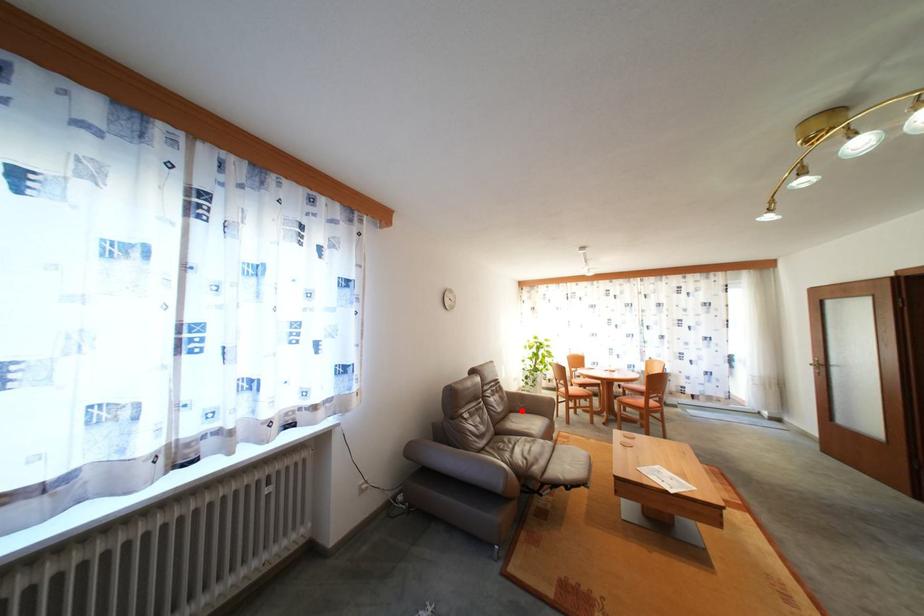
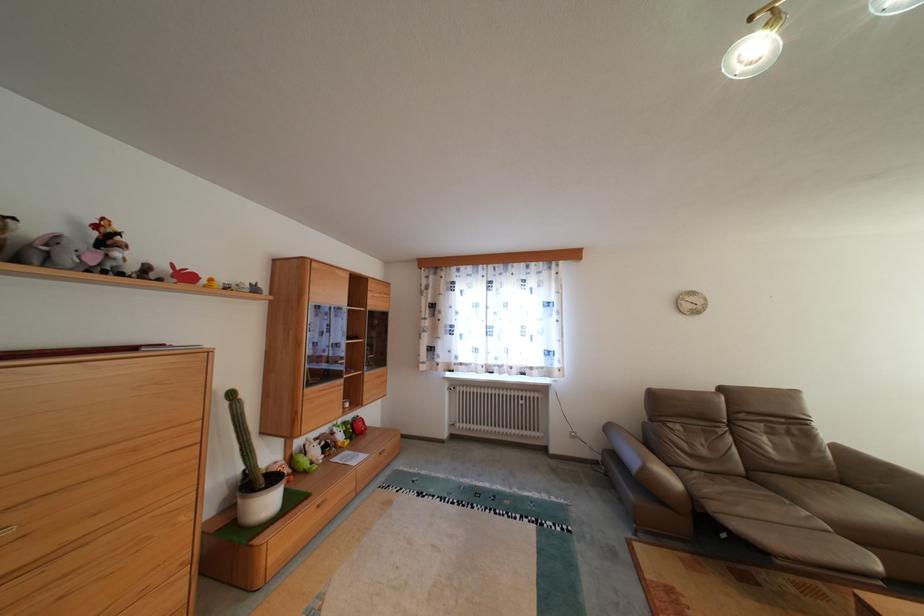
Question: I am providing you with two images of the same scene from different viewpoints. A red point is shown in image1. For the corresponding object point in image2, is it positioned nearer or farther from the camera?

Choices:
 (A) Nearer
 (B) Farther

Answer: (A)